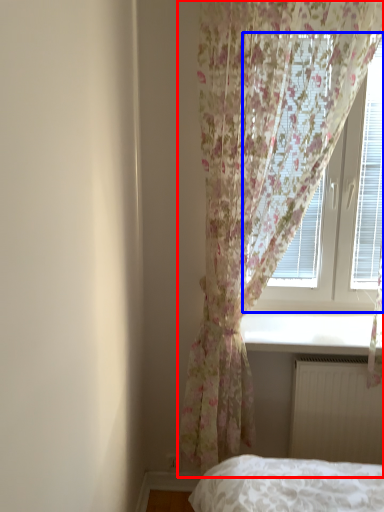
Question: Among these objects, which one is nearest to the camera, curtain (highlighted by a red box) or window (highlighted by a blue box)?

Choices:
 (A) curtain
 (B) window

Answer: (A)